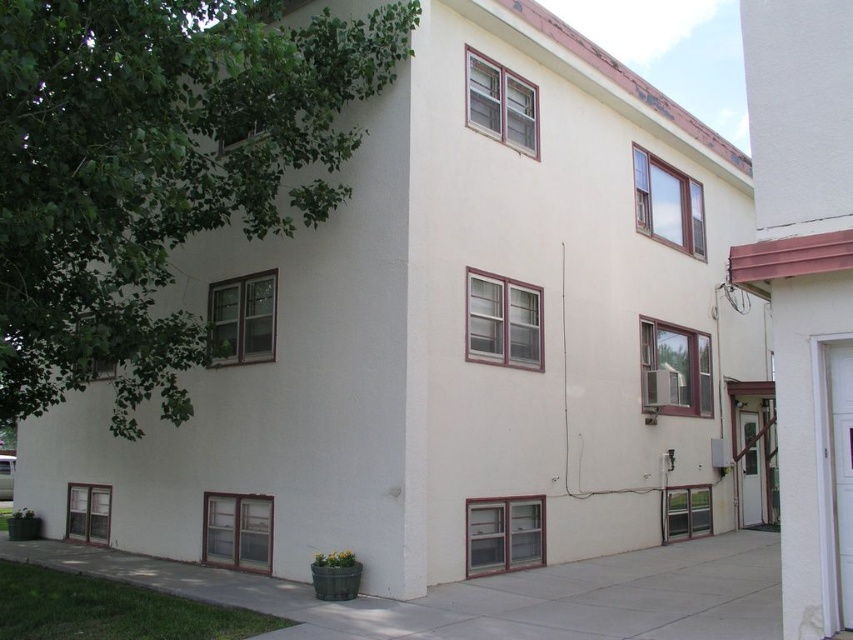
Does green leafy tree at upper left have a lesser height compared to white glossy door at lower right?

Yes.

Does green leafy tree at upper left have a greater height compared to white glossy door at lower right?

Incorrect, green leafy tree at upper left's height is not larger of white glossy door at lower right's.

Who is more forward, (293, 204) or (747, 486)?

Point (293, 204) is in front.

Find the location of a particular element. This screenshot has width=853, height=640. green leafy tree at upper left is located at coordinates (155, 172).

Is green leafy tree at upper left further to camera compared to white glossy door at right?

Yes, it is behind white glossy door at right.

Which is below, green leafy tree at upper left or white glossy door at right?

Positioned lower is white glossy door at right.

Identify the location of green leafy tree at upper left. (155, 172).

You are a GUI agent. You are given a task and a screenshot of the screen. Output one action in this format:
    pyautogui.click(x=<x>, y=<y>)
    Task: Click on the green leafy tree at upper left
    The width and height of the screenshot is (853, 640).
    Given the screenshot: What is the action you would take?
    pyautogui.click(x=155, y=172)

Is white glossy door at right bigger than white glossy door at lower right?

Actually, white glossy door at right might be smaller than white glossy door at lower right.

Can you confirm if white glossy door at right is wider than white glossy door at lower right?

No, white glossy door at right is not wider than white glossy door at lower right.

Which is in front, point (840, 416) or point (756, 426)?

Point (840, 416)

Where is `white glossy door at right`? This screenshot has height=640, width=853. white glossy door at right is located at coordinates (839, 467).